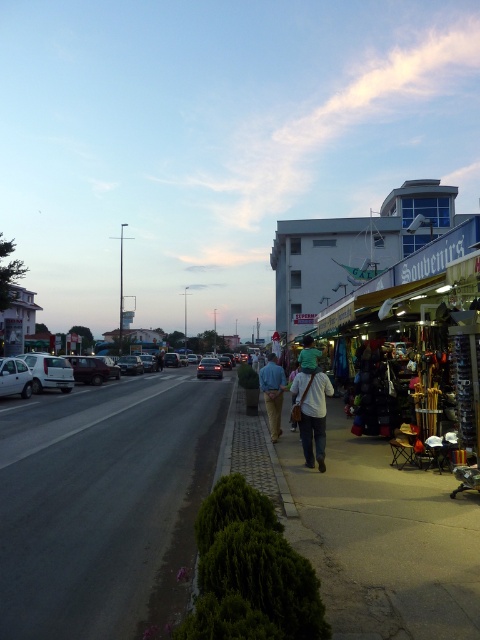
You are standing on the sidewalk on the left side of the street. You see a point marked at coordinates [104,504]. Is this point located on the dark asphalt road or on the sidewalk?

The point marked at coordinates [104,504] is on the dark asphalt road at lower left, so it is located on the road.

You are a pedestrian standing on the sidewalk and want to cross the road to reach a store on the other side. There are two cars in the center of the road, a matte black car at center and a dark gray metallic car at center. Which car should you wait behind before proceeding?

You should wait behind the dark gray metallic car at center because the matte black car at center is positioned to its left, meaning the dark gray metallic car at center is closer to your side of the sidewalk.